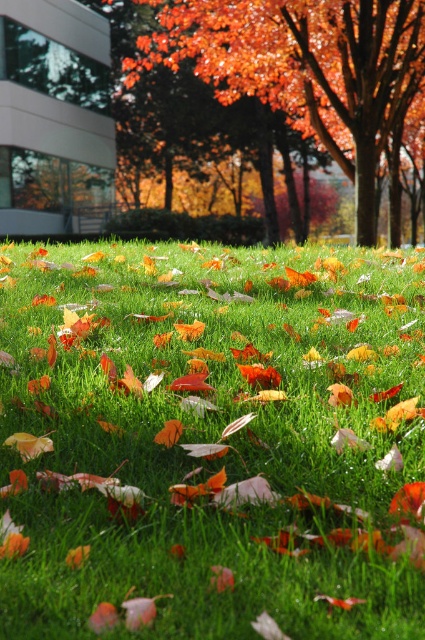
You are standing in the autumn scene and want to walk from the green grassy at center to the orange matte tree at center. Which direction should you move to reach the tree?

To reach the orange matte tree at center from the green grassy at center, you should move to the right since the green grassy at center is located to the left of the orange matte tree at center.

You are planning to place a small garden ornament that requires a 1 meter wide space. You see the green grassy at center and the orange matte tree at center. Which area can accommodate the ornament?

The orange matte tree at center has a wider space compared to the green grassy at center, so the ornament can be placed there since it requires 1 meter width.